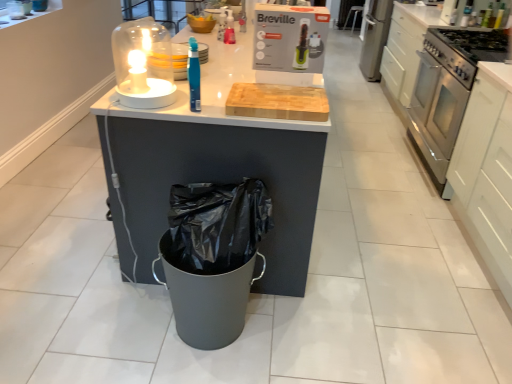
Question: Should I look upward or downward to see translucent glass candle at upper left?

Choices:
 (A) up
 (B) down

Answer: (A)

Question: Could you tell me if stainless steel gas stove at right is facing metallic silver bar stool at center?

Choices:
 (A) no
 (B) yes

Answer: (A)

Question: Is stainless steel gas stove at right further to camera compared to metallic silver bar stool at center?

Choices:
 (A) yes
 (B) no

Answer: (B)

Question: Is stainless steel gas stove at right completely or partially outside of metallic silver bar stool at center?

Choices:
 (A) no
 (B) yes

Answer: (B)

Question: Is stainless steel gas stove at right far away from metallic silver bar stool at center?

Choices:
 (A) yes
 (B) no

Answer: (A)

Question: Can you confirm if stainless steel gas stove at right is positioned to the left of metallic silver bar stool at center?

Choices:
 (A) no
 (B) yes

Answer: (B)

Question: Is stainless steel gas stove at right touching metallic silver bar stool at center?

Choices:
 (A) no
 (B) yes

Answer: (A)

Question: From a real-world perspective, is white matte cabinet at right located higher than stainless steel oven at right?

Choices:
 (A) yes
 (B) no

Answer: (A)

Question: From the image's perspective, is white matte cabinet at right located above stainless steel oven at right?

Choices:
 (A) yes
 (B) no

Answer: (B)

Question: Is the position of white matte cabinet at right less distant than that of stainless steel oven at right?

Choices:
 (A) yes
 (B) no

Answer: (A)

Question: Does white matte cabinet at right touch stainless steel oven at right?

Choices:
 (A) yes
 (B) no

Answer: (B)

Question: Is white matte cabinet at right not inside stainless steel oven at right?

Choices:
 (A) yes
 (B) no

Answer: (A)

Question: Is white matte cabinet at right turned away from stainless steel oven at right?

Choices:
 (A) yes
 (B) no

Answer: (B)

Question: Does stainless steel oven at right have a greater height compared to metallic silver bar stool at center?

Choices:
 (A) no
 (B) yes

Answer: (B)